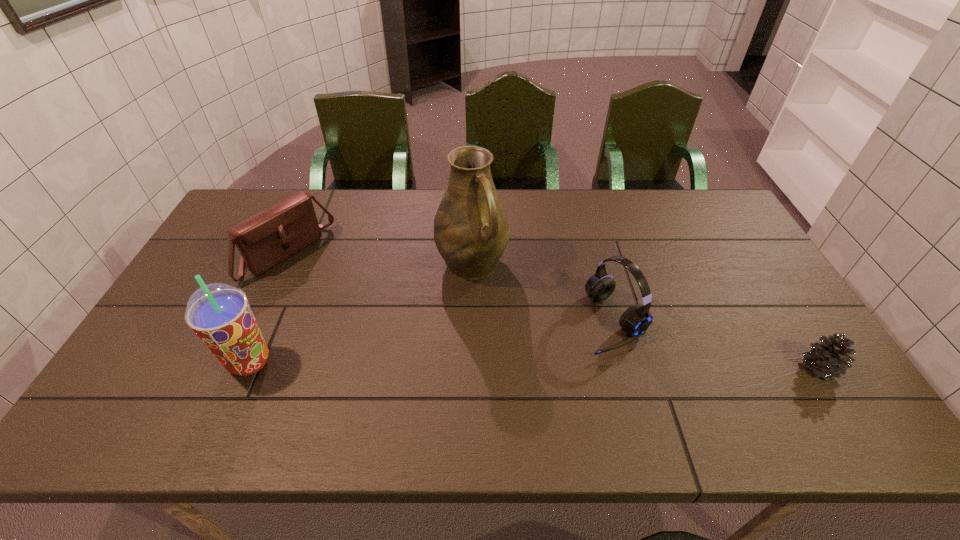
Identify the location of smoothie. (220, 315).

The height and width of the screenshot is (540, 960). In order to click on pinecone in this screenshot , I will do `click(830, 359)`.

Where is `the rightmost object`? The width and height of the screenshot is (960, 540). the rightmost object is located at coordinates (830, 359).

Where is `the fourth object from left to right`? the fourth object from left to right is located at coordinates (636, 319).

What are the coordinates of `the third object from right to left` in the screenshot? It's located at (471, 230).

The width and height of the screenshot is (960, 540). I want to click on pitcher, so [x=471, y=230].

What are the coordinates of `shoulder bag` in the screenshot? It's located at (267, 238).

Find the location of a particular element. This screenshot has width=960, height=540. vacant area located on the back of the smoothie is located at coordinates 299,252.

Locate an element on the screen. Image resolution: width=960 pixels, height=540 pixels. vacant region located 0.360m on the back of the rightmost object is located at coordinates (749, 257).

Find the location of `free region located 0.150m on the ear cushions of the headset`. free region located 0.150m on the ear cushions of the headset is located at coordinates (545, 364).